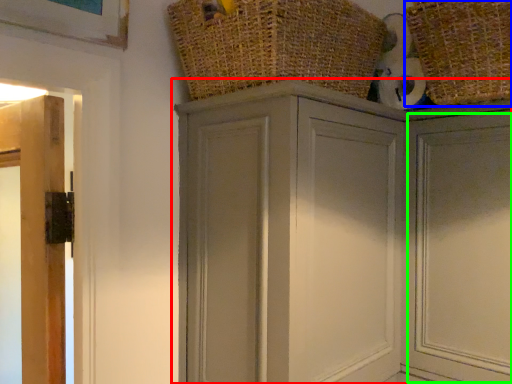
Question: Based on their relative distances, which object is farther from cupboard (highlighted by a red box)? Choose from basket (highlighted by a blue box) and door (highlighted by a green box).

Choices:
 (A) basket
 (B) door

Answer: (A)